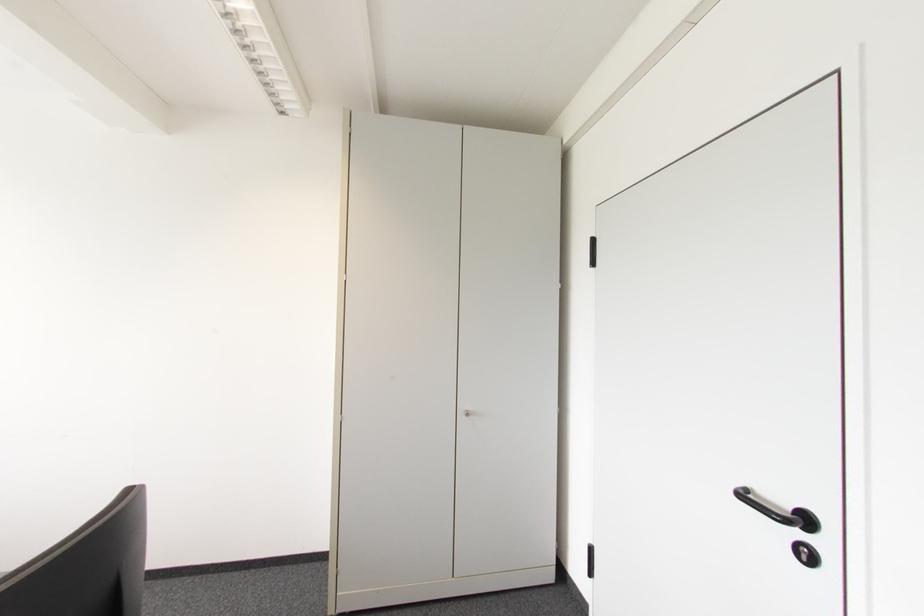
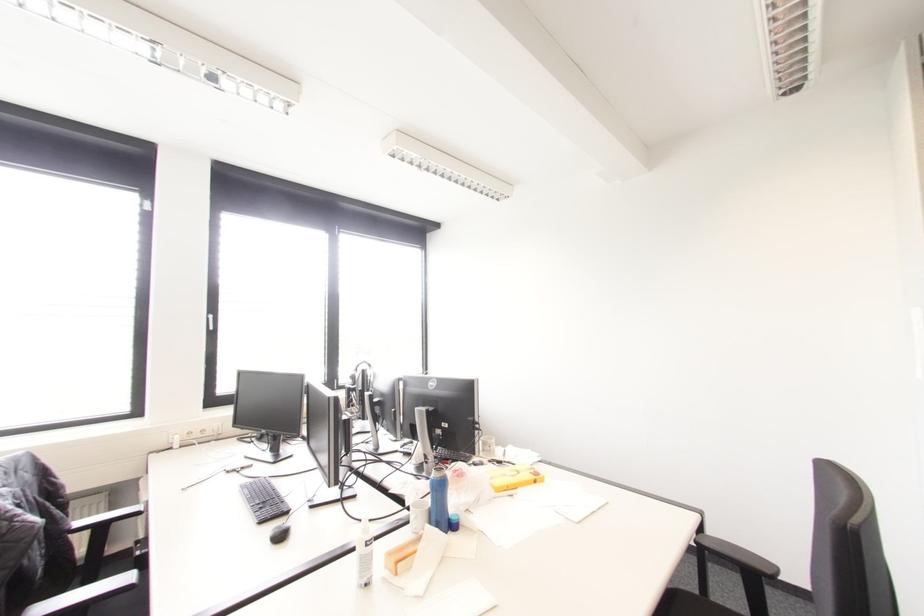
Question: The images are taken continuously from a first-person perspective. In which direction is your viewpoint rotating?

Choices:
 (A) Left
 (B) Right
 (C) Up
 (D) Down

Answer: (A)